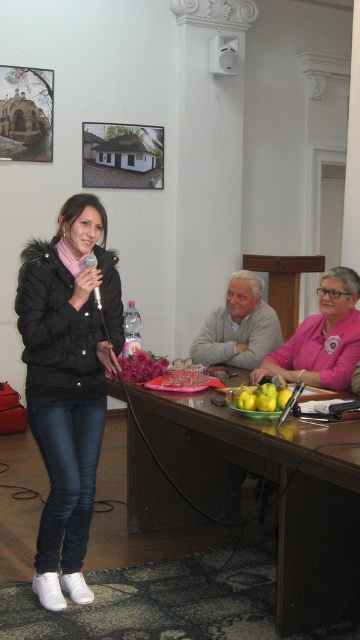
Question: Does brown wooden table at center lie behind gray woolen sweater at center?

Choices:
 (A) yes
 (B) no

Answer: (B)

Question: Which object is positioned farthest from the gray woolen sweater at center?

Choices:
 (A) brown wooden table at center
 (B) pink fabric at center
 (C) black puffer jacket at left

Answer: (C)

Question: From the image, what is the correct spatial relationship of pink fabric at center in relation to gray woolen sweater at center?

Choices:
 (A) right
 (B) left

Answer: (A)

Question: Which point is closer to the camera taking this photo?

Choices:
 (A) (114, 387)
 (B) (106, 310)
 (C) (235, 56)
 (D) (237, 301)

Answer: (B)

Question: Which of the following is the farthest from the observer?

Choices:
 (A) (338, 298)
 (B) (92, 289)
 (C) (267, 323)

Answer: (C)

Question: Is brown wooden table at center in front of gray woolen sweater at center?

Choices:
 (A) no
 (B) yes

Answer: (B)